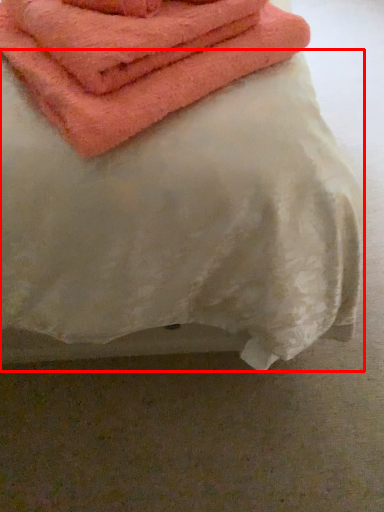
Question: From the image's perspective, where is sheet (annotated by the red box) located relative to towel?

Choices:
 (A) below
 (B) above

Answer: (B)